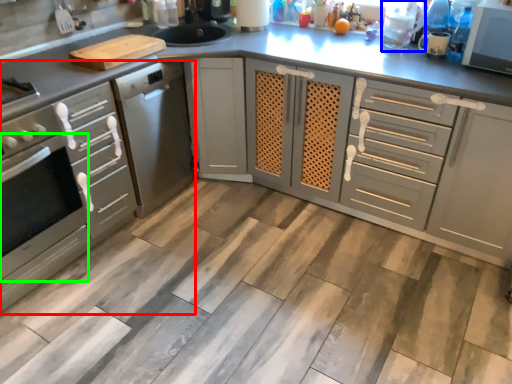
Question: Estimate the real-world distances between objects in this image. Which object is farther from cabinetry (highlighted by a red box), appliance (highlighted by a blue box) or oven (highlighted by a green box)?

Choices:
 (A) appliance
 (B) oven

Answer: (A)